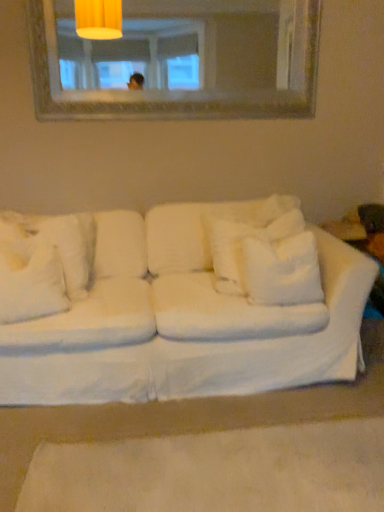
Question: Considering the relative positions of white fluffy pillow at left, which ranks as the 3th pillow in right-to-left order, and white fluffy pillow at center, the 2th pillow in the right-to-left sequence, in the image provided, is white fluffy pillow at left, which ranks as the 3th pillow in right-to-left order, behind white fluffy pillow at center, the 2th pillow in the right-to-left sequence,?

Choices:
 (A) no
 (B) yes

Answer: (A)

Question: Does white fluffy pillow at left, the 2th pillow viewed from the left, appear on the left side of white fluffy pillow at center, the 2th pillow in the right-to-left sequence?

Choices:
 (A) yes
 (B) no

Answer: (A)

Question: Considering the relative sizes of white fluffy pillow at left, which ranks as the 3th pillow in right-to-left order, and white fluffy pillow at center, the third pillow from the left, in the image provided, is white fluffy pillow at left, which ranks as the 3th pillow in right-to-left order, taller than white fluffy pillow at center, the third pillow from the left,?

Choices:
 (A) no
 (B) yes

Answer: (A)

Question: Considering the relative sizes of white fluffy pillow at left, the 2th pillow viewed from the left, and white fluffy pillow at center, the 2th pillow in the right-to-left sequence, in the image provided, is white fluffy pillow at left, the 2th pillow viewed from the left, shorter than white fluffy pillow at center, the 2th pillow in the right-to-left sequence,?

Choices:
 (A) yes
 (B) no

Answer: (A)

Question: Can you confirm if white fluffy pillow at left, the 2th pillow viewed from the left, is thinner than white fluffy pillow at center, the third pillow from the left?

Choices:
 (A) yes
 (B) no

Answer: (B)

Question: Can white fluffy pillow at center, the 2th pillow in the right-to-left sequence, be found inside white fluffy pillow at left, the 2th pillow viewed from the left?

Choices:
 (A) yes
 (B) no

Answer: (B)

Question: Can you confirm if white fluffy pillow at left, which ranks as the 3th pillow in right-to-left order, is bigger than white soft pillow at center, the fourth pillow in the left-to-right sequence?

Choices:
 (A) yes
 (B) no

Answer: (A)

Question: Is white fluffy pillow at left, the 2th pillow viewed from the left, thinner than white soft pillow at center, the fourth pillow in the left-to-right sequence?

Choices:
 (A) no
 (B) yes

Answer: (A)

Question: Is white fluffy pillow at left, which ranks as the 3th pillow in right-to-left order, at the right side of white soft pillow at center, the fourth pillow in the left-to-right sequence?

Choices:
 (A) yes
 (B) no

Answer: (B)

Question: Is white fluffy pillow at left, which ranks as the 3th pillow in right-to-left order, next to white soft pillow at center, the fourth pillow in the left-to-right sequence, and touching it?

Choices:
 (A) yes
 (B) no

Answer: (B)

Question: Are white fluffy pillow at left, the 2th pillow viewed from the left, and white soft pillow at center, arranged as the 1th pillow when viewed from the right, far apart?

Choices:
 (A) yes
 (B) no

Answer: (B)

Question: From the image's perspective, would you say white fluffy pillow at left, the 2th pillow viewed from the left, is shown under white soft pillow at center, the fourth pillow in the left-to-right sequence?

Choices:
 (A) no
 (B) yes

Answer: (B)

Question: Does white fabric couch at center have a greater width compared to white fluffy pillow at center, the 2th pillow in the right-to-left sequence?

Choices:
 (A) no
 (B) yes

Answer: (B)